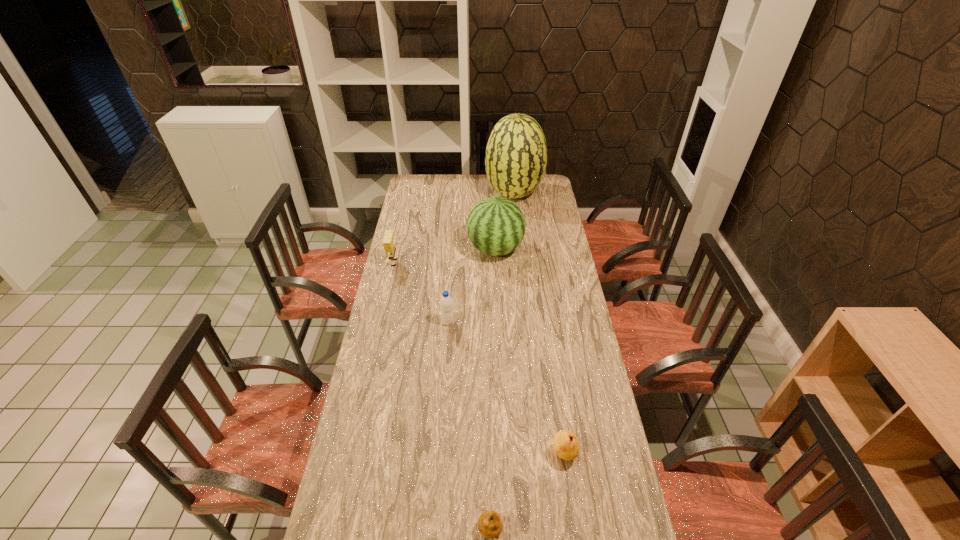
You are a GUI agent. You are given a task and a screenshot of the screen. Output one action in this format:
    pyautogui.click(x=<x>, y=<y>)
    Task: Click on the vacant space at the left edge
    Image resolution: width=960 pixels, height=540 pixels.
    Given the screenshot: What is the action you would take?
    [367, 361]

In the image, there is a desktop. Where is `free space at the right edge`? free space at the right edge is located at coordinates (574, 464).

Find the location of a particular element. free space between the fifth shortest object and the sponge is located at coordinates (445, 256).

Identify the location of free spot between the farther watermelon and the water bottle. (481, 258).

Identify the location of free space between the fifth object from right to left and the sponge. Image resolution: width=960 pixels, height=540 pixels. (421, 293).

Locate an element on the screen. free space between the taller pear and the fifth object from right to left is located at coordinates (506, 388).

Find the location of `free space between the taller pear and the farthest object`. free space between the taller pear and the farthest object is located at coordinates (539, 324).

Identify the location of the fifth closest object relative to the fifth object from right to left. The height and width of the screenshot is (540, 960). (516, 155).

This screenshot has width=960, height=540. I want to click on the third closest object relative to the leftmost object, so click(516, 155).

Identify the location of vacant position in the image that satisfies the following two spatial constraints: 1. on the face of the leftmost object; 2. on the left side of the second object from left to right. The height and width of the screenshot is (540, 960). (383, 322).